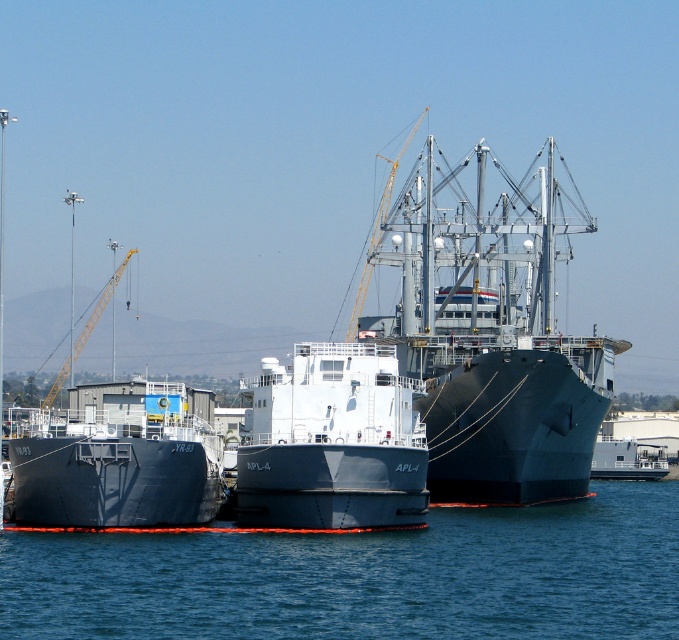
Between matte black ship at center and metallic gray boat at center, which one has less height?

With less height is metallic gray boat at center.

Which is in front, point (538, 412) or point (623, 445)?

Point (538, 412) is in front.

Who is more forward, [430,497] or [636,470]?

Point [430,497]

This screenshot has width=679, height=640. I want to click on matte black ship at center, so click(492, 340).

Between blue water at center and metallic gray boat at center, which one has less height?

metallic gray boat at center

Between blue water at center and metallic gray boat at center, which one is positioned lower?

metallic gray boat at center is below.

This screenshot has height=640, width=679. Find the location of `blue water at center`. blue water at center is located at coordinates (365, 577).

In order to click on blue water at center in this screenshot , I will do `click(365, 577)`.

Can you confirm if matte gray ship at center is positioned to the left of metallic gray boat at center?

Yes, matte gray ship at center is to the left of metallic gray boat at center.

Is point (418, 486) positioned behind point (595, 467)?

No, it is in front of (595, 467).

Find the location of a particular element. This screenshot has width=679, height=640. matte gray ship at center is located at coordinates (331, 442).